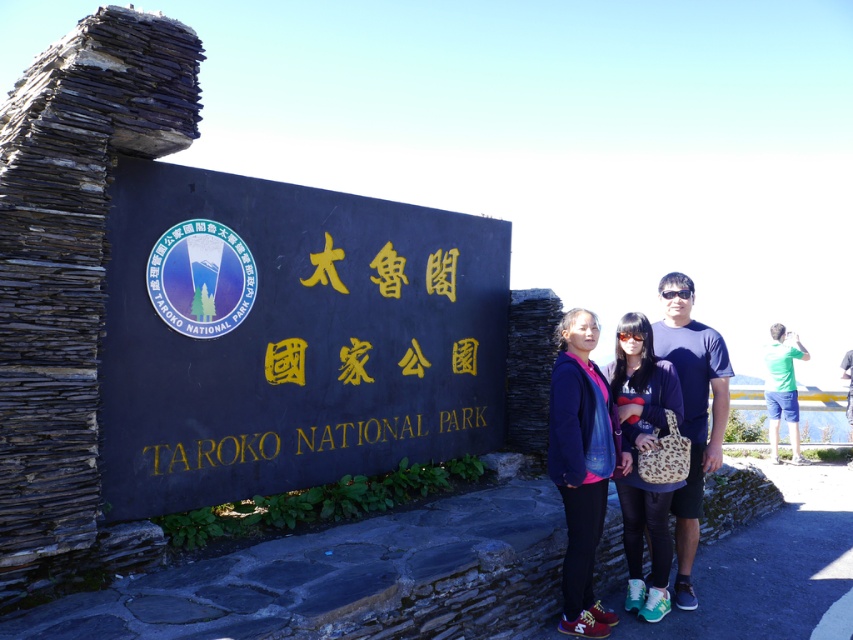
In the scene shown: Does matte blue jacket at center have a greater width compared to transparent plastic goggles at center?

Yes.

Identify the location of matte blue jacket at center. tap(581, 465).

Locate an element on the screen. The image size is (853, 640). matte blue jacket at center is located at coordinates (581, 465).

Is point (225, 195) farther from camera compared to point (621, 332)?

No, it is in front of (621, 332).

Which of these two, black stone sign at center or transparent plastic goggles at center, stands shorter?

transparent plastic goggles at center

Is point (115, 202) more distant than point (642, 340)?

No, (115, 202) is in front of (642, 340).

Where is `black stone sign at center`? black stone sign at center is located at coordinates (289, 337).

Is matte black shirt at center above goldmaterial/texturetaroko national park at center?

Yes.

Is matte black shirt at center closer to the viewer compared to goldmaterial/texturetaroko national park at center?

No, matte black shirt at center is behind goldmaterial/texturetaroko national park at center.

Where is `matte black shirt at center`? The height and width of the screenshot is (640, 853). matte black shirt at center is located at coordinates (660, 436).

Identify the location of matte black shirt at center. (660, 436).